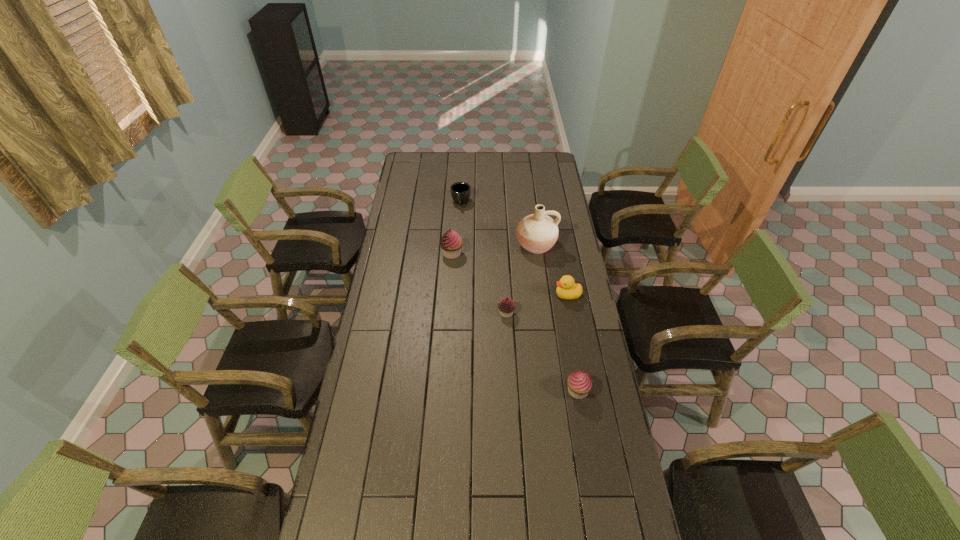
I want to click on free space between the tallest object and the farthest cupcake, so click(494, 249).

The image size is (960, 540). In order to click on free space that is in between the farthest object and the fifth shortest object in this screenshot , I will do `click(457, 228)`.

The image size is (960, 540). I want to click on vacant region between the second cupcake from left to right and the fourth farthest object, so click(x=537, y=303).

The height and width of the screenshot is (540, 960). In order to click on vacant point located between the duck and the pottery in this screenshot , I will do `click(552, 269)`.

Locate an element on the screen. free space between the third nearest object and the fifth shortest object is located at coordinates (510, 274).

This screenshot has width=960, height=540. Identify the location of vacant point located between the farthest object and the leftmost cupcake. (457, 228).

Identify the location of vacant area that lies between the second cupcake from left to right and the tallest object. The width and height of the screenshot is (960, 540). coord(521,279).

This screenshot has height=540, width=960. I want to click on the third closest object to the farthest cupcake, so click(x=506, y=306).

The height and width of the screenshot is (540, 960). I want to click on the fifth closest object to the fourth farthest object, so click(x=460, y=191).

This screenshot has width=960, height=540. I want to click on cupcake identified as the second closest to the fourth farthest object, so click(x=580, y=383).